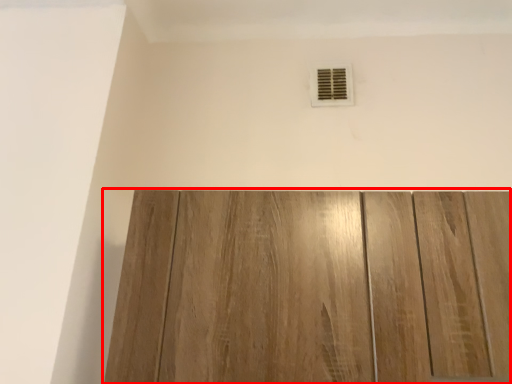
Question: From the image, what is the correct spatial relationship of door (annotated by the red box) in relation to air conditioning?

Choices:
 (A) left
 (B) right

Answer: (A)